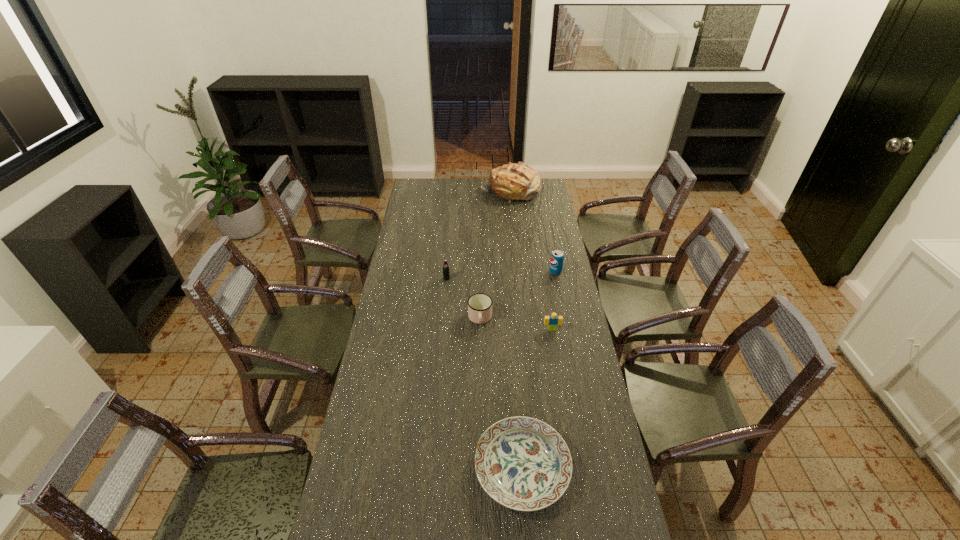
This screenshot has width=960, height=540. Find the location of `free spot between the tallest object and the second farthest object`. free spot between the tallest object and the second farthest object is located at coordinates (533, 232).

The height and width of the screenshot is (540, 960). In order to click on free space that is in between the farther pop and the bread in this screenshot , I will do `click(533, 232)`.

The height and width of the screenshot is (540, 960). I want to click on vacant area between the right pop and the mug, so click(x=517, y=295).

Locate an element on the screen. The image size is (960, 540). vacant space that's between the Lego and the right pop is located at coordinates (554, 300).

Where is `vacant space in between the farthest object and the fourth nearest object`? Image resolution: width=960 pixels, height=540 pixels. vacant space in between the farthest object and the fourth nearest object is located at coordinates pyautogui.click(x=478, y=235).

Identify which object is the third nearest to the tallest object. Please provide its 2D coordinates. Your answer should be formatted as a tuple, i.e. [(x, y)], where the tuple contains the x and y coordinates of a point satisfying the conditions above.

[(479, 305)]

This screenshot has width=960, height=540. Identify the location of object that stands as the fifth closest to the bread. (522, 463).

Image resolution: width=960 pixels, height=540 pixels. I want to click on vacant region that satisfies the following two spatial constraints: 1. on the back side of the right pop; 2. on the left side of the nearest object, so click(x=508, y=272).

Find the location of a particular element. This screenshot has height=540, width=960. free spot that satisfies the following two spatial constraints: 1. on the front label of the leftmost object; 2. on the right side of the shortest object is located at coordinates (430, 468).